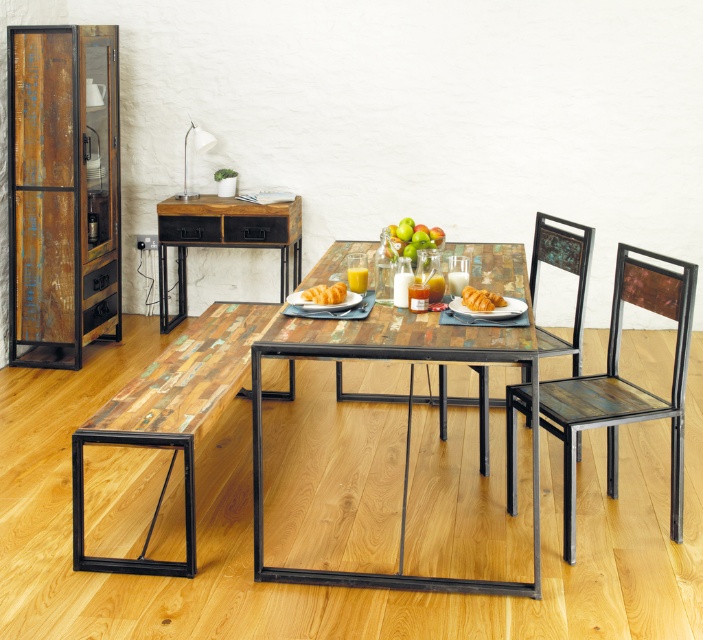
Between point (586, 260) and point (437, 244), which one is positioned behind?

Positioned behind is point (586, 260).

Is point (565, 266) farther from viewer compared to point (413, 256)?

That is True.

Where is `rustic wood chair at center`? rustic wood chair at center is located at coordinates (562, 269).

Does golden flaky croissant at center appear over golden brown croissant at center?

Actually, golden flaky croissant at center is below golden brown croissant at center.

Between point (498, 296) and point (337, 285), which one is positioned in front?

Positioned in front is point (498, 296).

Is point (494, 300) behind point (316, 298)?

That is False.

Identify the location of golden flaky croissant at center. (479, 298).

Image resolution: width=703 pixels, height=640 pixels. I want to click on multicolored wood table at center, so click(411, 400).

In the scene shown: Is multicolored wood table at center thinner than rustic wood chair at center?

No, multicolored wood table at center is not thinner than rustic wood chair at center.

The image size is (703, 640). What do you see at coordinates (411, 400) in the screenshot?
I see `multicolored wood table at center` at bounding box center [411, 400].

Where is `multicolored wood table at center`? multicolored wood table at center is located at coordinates (411, 400).